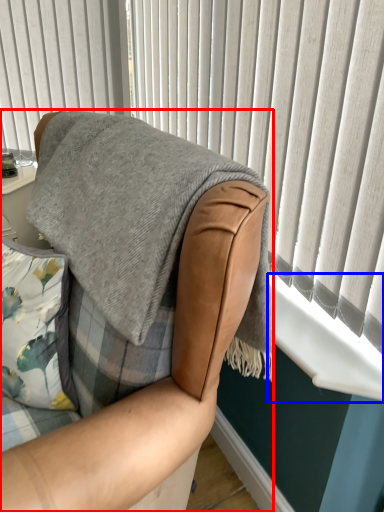
Question: Which point is closer to the camera, chair (highlighted by a red box) or window sill (highlighted by a blue box)?

Choices:
 (A) chair
 (B) window sill

Answer: (A)